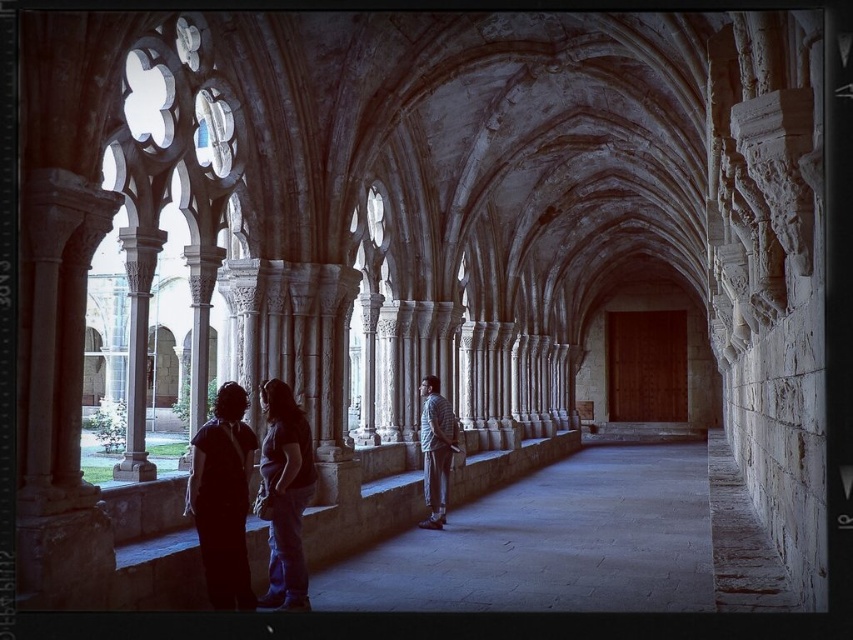
Consider the image. You are standing in the historic cloister and want to take a photo of both point (x=229, y=570) and point (x=424, y=472). To ensure both points are in focus, which point should you focus on first?

You should focus on point (x=229, y=570) first because it is closer to the camera than point (x=424, y=472).

You are standing in the historic cloister and see two shirts at the center area. Which shirt is nearer to you, the dark gray fabric shirt at center or the plaid shirt at center?

The dark gray fabric shirt at center is closer to the viewer than the plaid shirt at center.